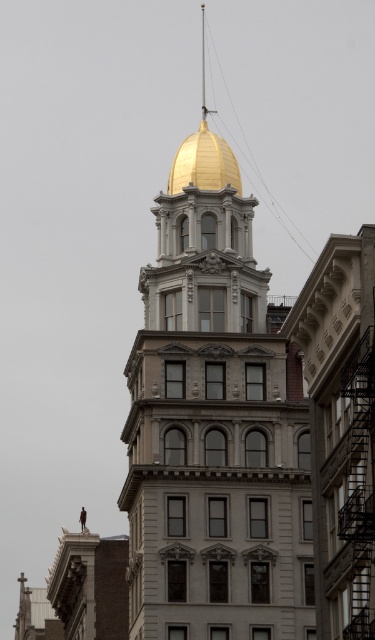
You are an architect examining the building and notice two gold polished domes. Which one is positioned closer to you, the gold polished dome at center or the gold polished dome at top?

The gold polished dome at center is closer to the viewer than the gold polished dome at top.

From the picture: You are standing in front of the tall ornate building. Where is the gold polished dome at center located in terms of coordinates?

The gold polished dome at center is located at coordinates point [214,438].